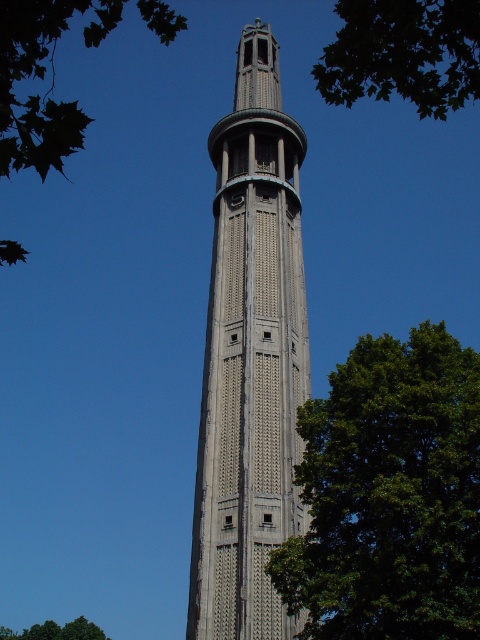
Who is more distant from viewer, (384, 88) or (22, 65)?

The point (384, 88) is more distant.

Measure the distance between point (447, 83) and camera.

They are 31.49 meters apart.

Who is more distant from viewer, (430,13) or (157,19)?

The point (157,19) is behind.

Where is `green leafy tree at upper right`? green leafy tree at upper right is located at coordinates (404, 52).

Does gray stone tower at center have a lesser width compared to green leafy tree at upper right?

Indeed, gray stone tower at center has a lesser width compared to green leafy tree at upper right.

Between point (216, 321) and point (444, 115), which one is positioned behind?

Positioned behind is point (444, 115).

Measure the distance between point (285, 252) and camera.

Point (285, 252) and camera are 58.75 meters apart from each other.

Locate an element on the screen. gray stone tower at center is located at coordinates (251, 358).

Is green leafy tree at center positioned behind green leafy tree at upper right?

Yes, green leafy tree at center is behind green leafy tree at upper right.

I want to click on green leafy tree at center, so click(x=389, y=493).